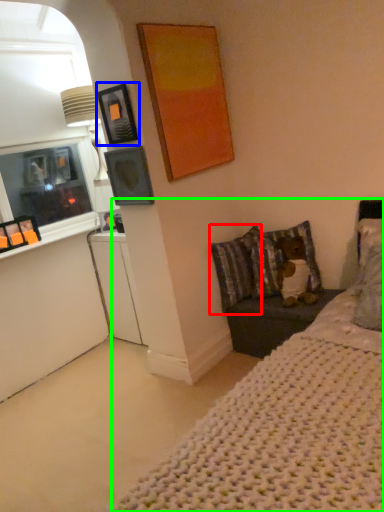
Question: Considering the real-world distances, which object is farthest from pillow (highlighted by a red box)? picture frame (highlighted by a blue box) or bed (highlighted by a green box)?

Choices:
 (A) picture frame
 (B) bed

Answer: (B)